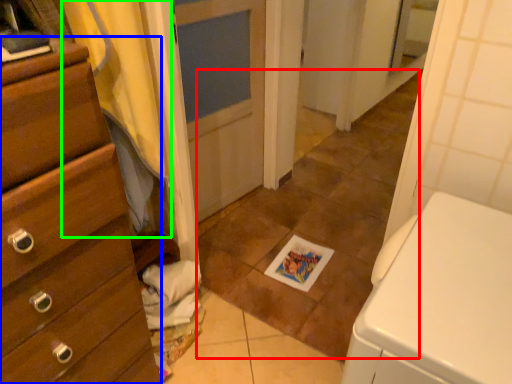
Question: Which object is positioned farthest from tile (highlighted by a red box)? Select from chest of drawers (highlighted by a blue box) and curtain (highlighted by a green box).

Choices:
 (A) chest of drawers
 (B) curtain

Answer: (A)